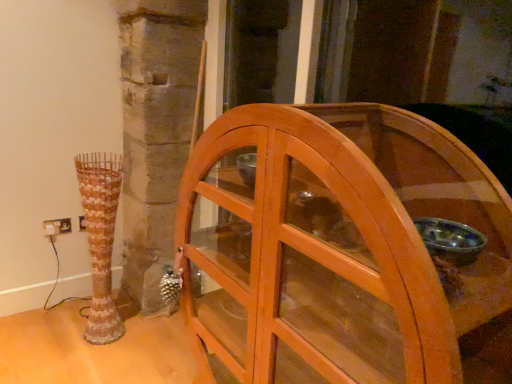
Question: Is white plastic electric outlet at lower left next to rustic ceramic vase at left and touching it?

Choices:
 (A) no
 (B) yes

Answer: (A)

Question: From the image's perspective, is white plastic electric outlet at lower left beneath rustic ceramic vase at left?

Choices:
 (A) yes
 (B) no

Answer: (B)

Question: Is white plastic electric outlet at lower left positioned behind rustic ceramic vase at left?

Choices:
 (A) yes
 (B) no

Answer: (A)

Question: From the image's perspective, is white plastic electric outlet at lower left over rustic ceramic vase at left?

Choices:
 (A) no
 (B) yes

Answer: (B)

Question: Is white plastic electric outlet at lower left not inside rustic ceramic vase at left?

Choices:
 (A) yes
 (B) no

Answer: (A)

Question: From their relative heights in the image, would you say rustic ceramic vase at left is taller or shorter than wooden cabinet at center?

Choices:
 (A) short
 (B) tall

Answer: (A)

Question: From a real-world perspective, relative to wooden cabinet at center, is rustic ceramic vase at left vertically above or below?

Choices:
 (A) above
 (B) below

Answer: (B)

Question: Does point (105, 314) appear closer or farther from the camera than point (211, 294)?

Choices:
 (A) farther
 (B) closer

Answer: (A)

Question: Do you think rustic ceramic vase at left is within wooden cabinet at center, or outside of it?

Choices:
 (A) inside
 (B) outside

Answer: (B)

Question: Is white plastic electric outlet at lower left bigger or smaller than wooden cabinet at center?

Choices:
 (A) small
 (B) big

Answer: (A)

Question: From the image's perspective, is white plastic electric outlet at lower left positioned above or below wooden cabinet at center?

Choices:
 (A) below
 (B) above

Answer: (B)

Question: From a real-world perspective, is white plastic electric outlet at lower left above or below wooden cabinet at center?

Choices:
 (A) below
 (B) above

Answer: (A)

Question: In terms of height, does white plastic electric outlet at lower left look taller or shorter compared to wooden cabinet at center?

Choices:
 (A) short
 (B) tall

Answer: (A)

Question: From the image's perspective, relative to rustic ceramic vase at left, is white plastic electric outlet at lower left above or below?

Choices:
 (A) above
 (B) below

Answer: (A)

Question: From a real-world perspective, is white plastic electric outlet at lower left physically located above or below rustic ceramic vase at left?

Choices:
 (A) below
 (B) above

Answer: (A)